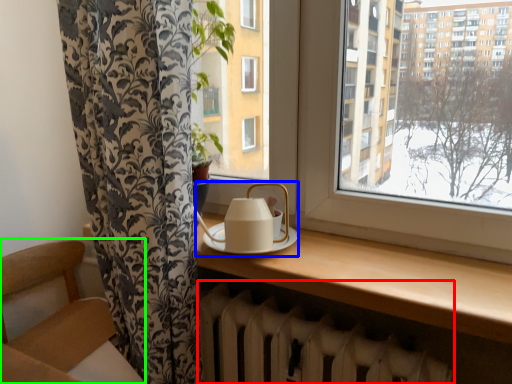
Question: Which is nearer to the radiator (highlighted by a red box)? tea set (highlighted by a blue box) or armchair (highlighted by a green box).

Choices:
 (A) tea set
 (B) armchair

Answer: (A)